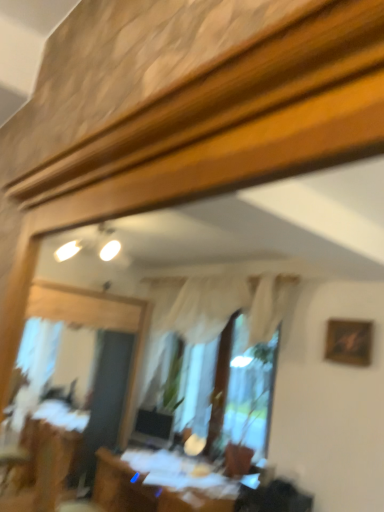
You are a GUI agent. You are given a task and a screenshot of the screen. Output one action in this format:
    pyautogui.click(x=<x>, y=<y>)
    Task: Click on the wooden table at lower center
    
    Given the screenshot: What is the action you would take?
    pyautogui.click(x=156, y=487)

The image size is (384, 512). What do you see at coordinates (156, 487) in the screenshot?
I see `wooden table at lower center` at bounding box center [156, 487].

Where is `wooden table at lower center`? The height and width of the screenshot is (512, 384). wooden table at lower center is located at coordinates (156, 487).